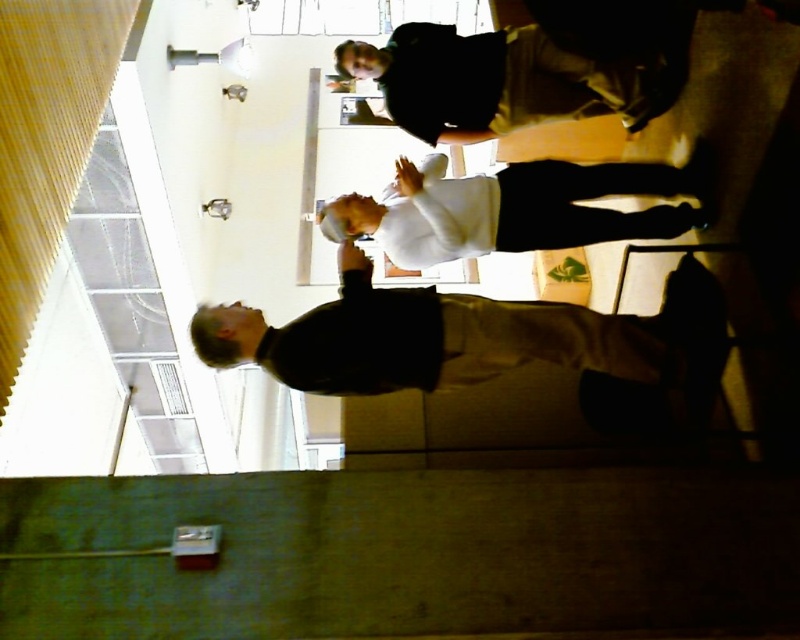
Between dark gray sweater at center and white matte shirt at center, which one has less height?

With less height is white matte shirt at center.

Identify the location of dark gray sweater at center. (488, 344).